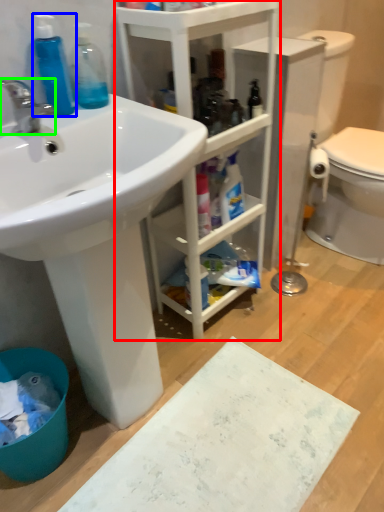
Question: Considering the real-world distances, which object is closest to bathroom cabinet (highlighted by a red box)? cleaning product (highlighted by a blue box) or tap (highlighted by a green box).

Choices:
 (A) cleaning product
 (B) tap

Answer: (A)